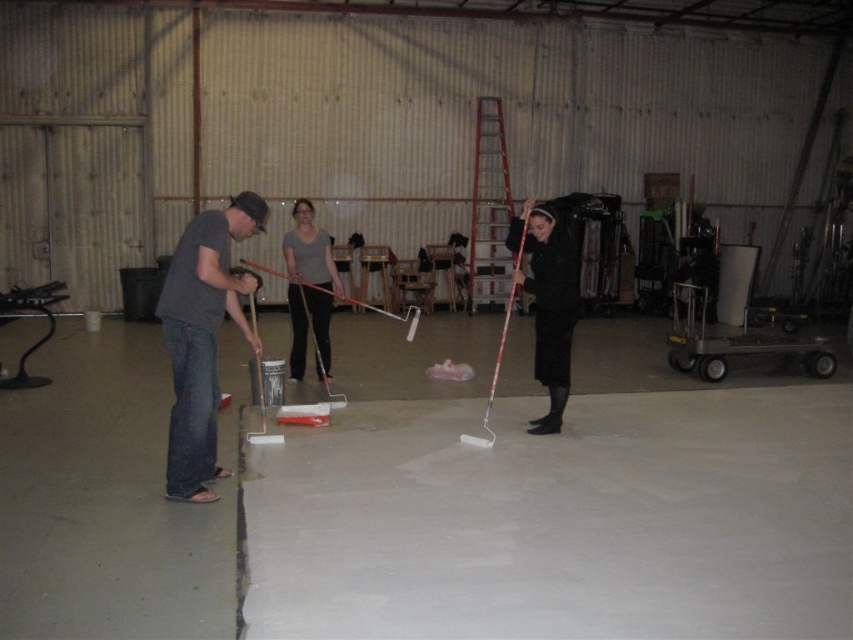
Question: Is the position of gray cotton t-shirt at left more distant than that of black matte coat at center?

Choices:
 (A) yes
 (B) no

Answer: (B)

Question: Is smooth concrete at center to the left of black matte coat at center from the viewer's perspective?

Choices:
 (A) no
 (B) yes

Answer: (A)

Question: Among these objects, which one is farthest from the camera?

Choices:
 (A) gray cotton t-shirt at left
 (B) smooth concrete at center
 (C) black matte coat at center

Answer: (C)

Question: Among these points, which one is farthest from the camera?

Choices:
 (A) (837, 627)
 (B) (184, 296)

Answer: (B)

Question: Which of the following is the farthest from the observer?

Choices:
 (A) (207, 253)
 (B) (786, 518)
 (C) (285, 253)
 (D) (555, 324)

Answer: (C)

Question: Considering the relative positions of smooth concrete at center and matte gray shirt at center in the image provided, where is smooth concrete at center located with respect to matte gray shirt at center?

Choices:
 (A) left
 (B) right

Answer: (B)